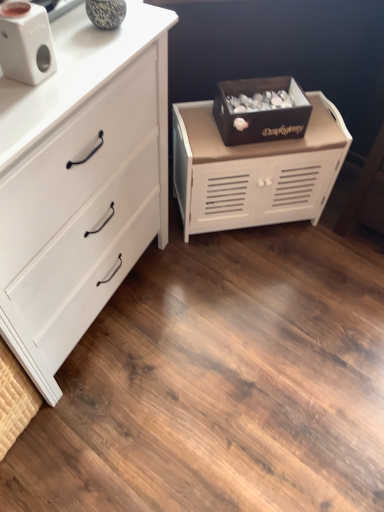
Image resolution: width=384 pixels, height=512 pixels. What are the coordinates of `empty space that is in between white matte cabinet at center, which is the first chest of drawers from right to left, and white matte chest of drawers at left, the first chest of drawers from the left` in the screenshot? It's located at (192, 283).